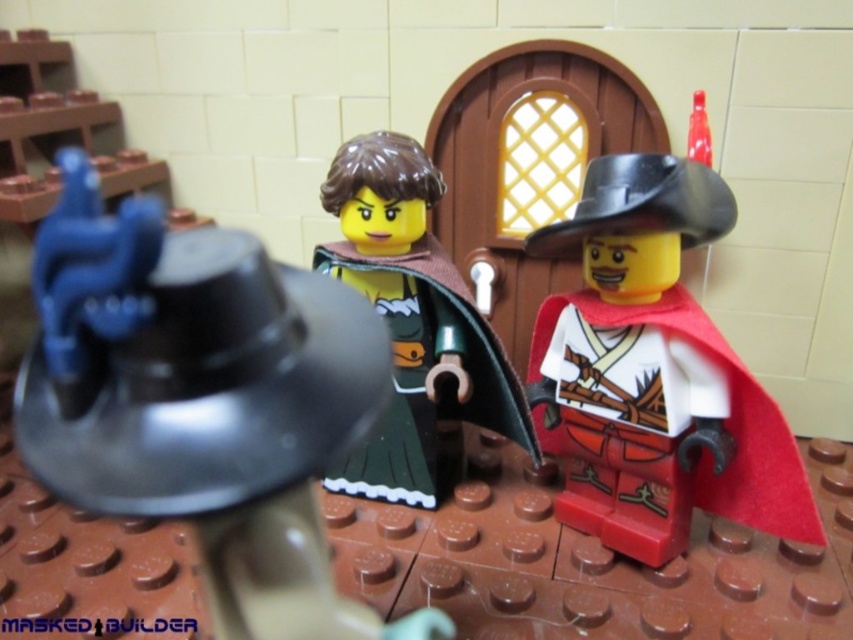
Can you confirm if smooth red cape at right is positioned to the right of green matte dress at center?

Correct, you'll find smooth red cape at right to the right of green matte dress at center.

Between point (689, 176) and point (347, 234), which one is positioned behind?

The point (347, 234) is behind.

Is point (795, 472) positioned behind point (403, 360)?

No.

This screenshot has height=640, width=853. Find the location of `smooth red cape at right`. smooth red cape at right is located at coordinates (654, 372).

Which is below, metallic silver helmet at upper left or smooth red cape at right?

metallic silver helmet at upper left

Which is behind, point (96, 193) or point (624, 444)?

Positioned behind is point (624, 444).

Identify the location of metallic silver helmet at upper left. The image size is (853, 640). (202, 401).

This screenshot has width=853, height=640. What do you see at coordinates (202, 401) in the screenshot? I see `metallic silver helmet at upper left` at bounding box center [202, 401].

Is metallic silver helmet at upper left to the left of green matte dress at center from the viewer's perspective?

Indeed, metallic silver helmet at upper left is positioned on the left side of green matte dress at center.

Is point (334, 332) less distant than point (357, 461)?

Yes, point (334, 332) is in front of point (357, 461).

Identify the location of metallic silver helmet at upper left. The width and height of the screenshot is (853, 640). (202, 401).